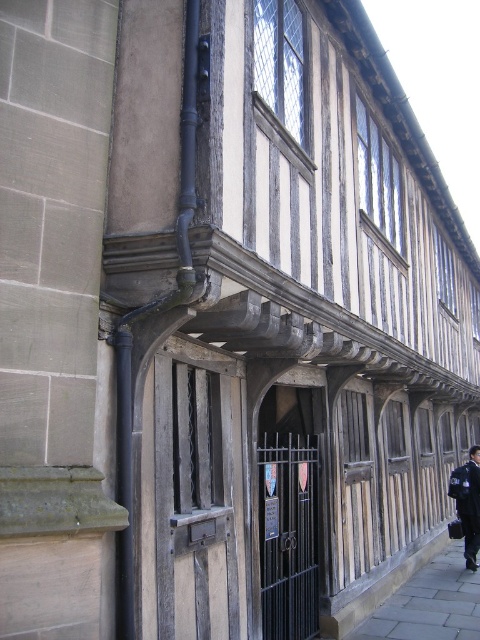
Question: Is paved stone sidewalk at lower right positioned in front of dark blue uniform at center?

Choices:
 (A) no
 (B) yes

Answer: (B)

Question: Which of the following is the closest to the observer?

Choices:
 (A) dark blue uniform at center
 (B) paved stone sidewalk at lower right

Answer: (B)

Question: Which point is closer to the camera?

Choices:
 (A) dark blue uniform at center
 (B) paved stone sidewalk at lower right

Answer: (B)

Question: Considering the relative positions of paved stone sidewalk at lower right and dark blue uniform at center in the image provided, where is paved stone sidewalk at lower right located with respect to dark blue uniform at center?

Choices:
 (A) below
 (B) above

Answer: (A)

Question: Can you confirm if paved stone sidewalk at lower right is positioned below dark blue uniform at center?

Choices:
 (A) yes
 (B) no

Answer: (A)